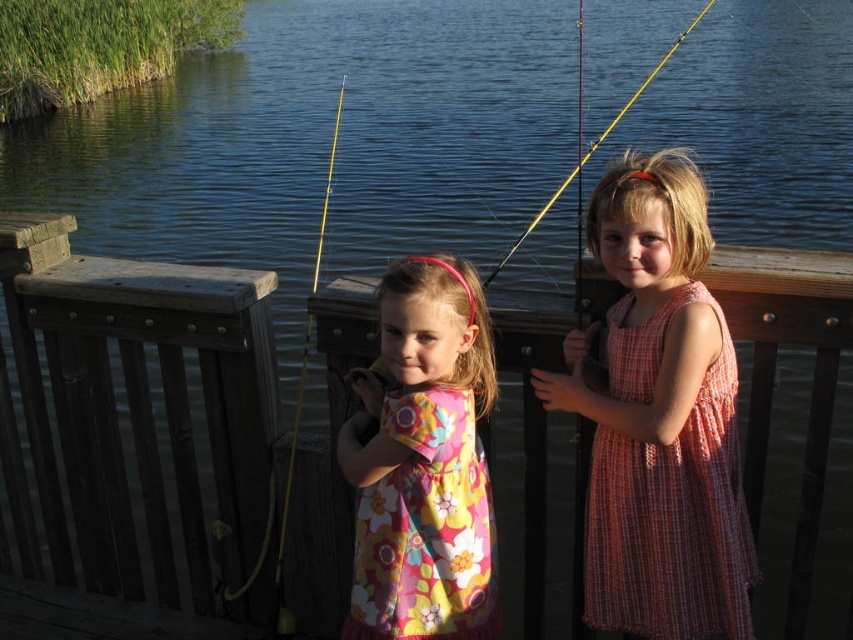
Is plaid cotton dress at center to the left of floral fabric dress at center from the viewer's perspective?

No, plaid cotton dress at center is not to the left of floral fabric dress at center.

Who is lower down, plaid cotton dress at center or floral fabric dress at center?

floral fabric dress at center

Measure the distance between plaid cotton dress at center and camera.

8.19 feet

What are the coordinates of `plaid cotton dress at center` in the screenshot? It's located at (659, 417).

Describe the element at coordinates (659, 417) in the screenshot. I see `plaid cotton dress at center` at that location.

Is plaid cotton dress at center thinner than yellow plastic fishing pole at center?

Yes.

Does point (677, 346) lie behind point (328, 164)?

No.

I want to click on plaid cotton dress at center, so click(x=659, y=417).

Is point (439, 424) behind point (538, 220)?

No, it is in front of (538, 220).

This screenshot has width=853, height=640. What do you see at coordinates (422, 461) in the screenshot?
I see `floral fabric dress at center` at bounding box center [422, 461].

Does point (483, 365) come farther from viewer compared to point (485, 284)?

That is False.

Locate an element on the screen. This screenshot has width=853, height=640. floral fabric dress at center is located at coordinates (422, 461).